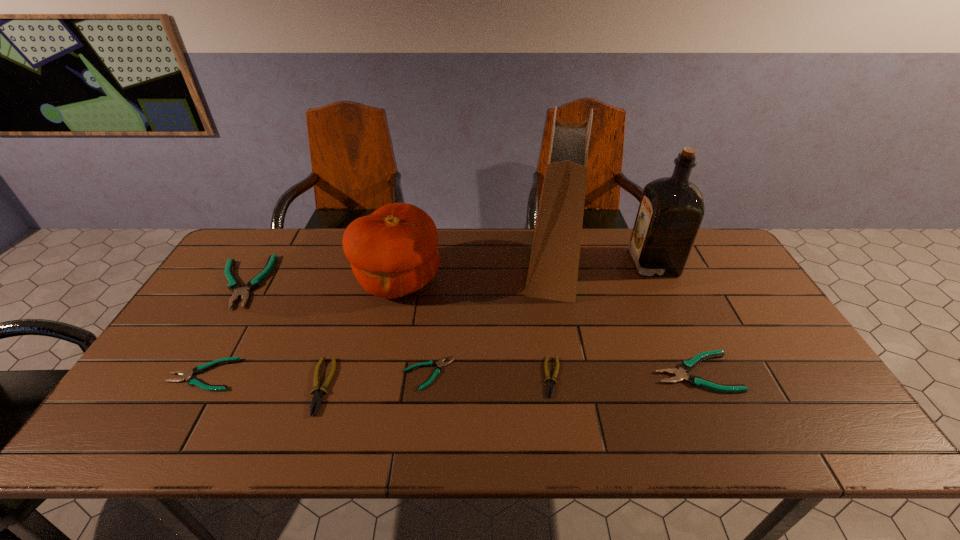
The height and width of the screenshot is (540, 960). Find the location of `vacant area located 0.120m on the front of the third smallest teal pliers`. vacant area located 0.120m on the front of the third smallest teal pliers is located at coordinates (726, 440).

The width and height of the screenshot is (960, 540). Identify the location of vacant space located 0.150m on the back of the fourth pliers from right to left. (343, 317).

Find the location of a particular element. The height and width of the screenshot is (540, 960). free space located 0.400m on the back of the third biggest teal pliers is located at coordinates (268, 262).

I want to click on blank area located on the back of the second pliers from right to left, so click(538, 280).

Find the location of a particular element. The image size is (960, 540). vacant space located 0.360m on the back of the shortest pliers is located at coordinates (440, 267).

The width and height of the screenshot is (960, 540). I want to click on shopping bag that is positioned at the far edge, so click(553, 270).

Where is `liquor present at the far edge`? The height and width of the screenshot is (540, 960). liquor present at the far edge is located at coordinates (671, 210).

Locate an element on the screen. pumpkin located at the far edge is located at coordinates (393, 252).

Locate an element on the screen. Image resolution: width=960 pixels, height=540 pixels. pliers located in the far edge section of the desktop is located at coordinates (234, 285).

Identify the location of object situated at the near edge. (317, 397).